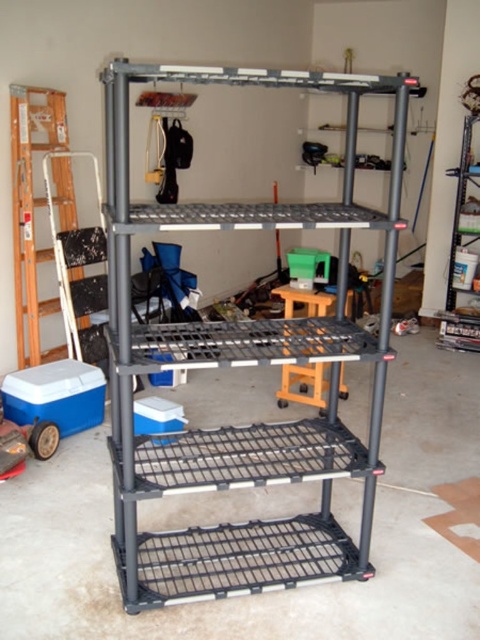
Is wooden ladder at left to the left of wooden stool at center from the viewer's perspective?

Indeed, wooden ladder at left is positioned on the left side of wooden stool at center.

Can you confirm if wooden ladder at left is smaller than wooden stool at center?

Incorrect, wooden ladder at left is not smaller in size than wooden stool at center.

The height and width of the screenshot is (640, 480). In order to click on wooden ladder at left in this screenshot , I will do `click(32, 209)`.